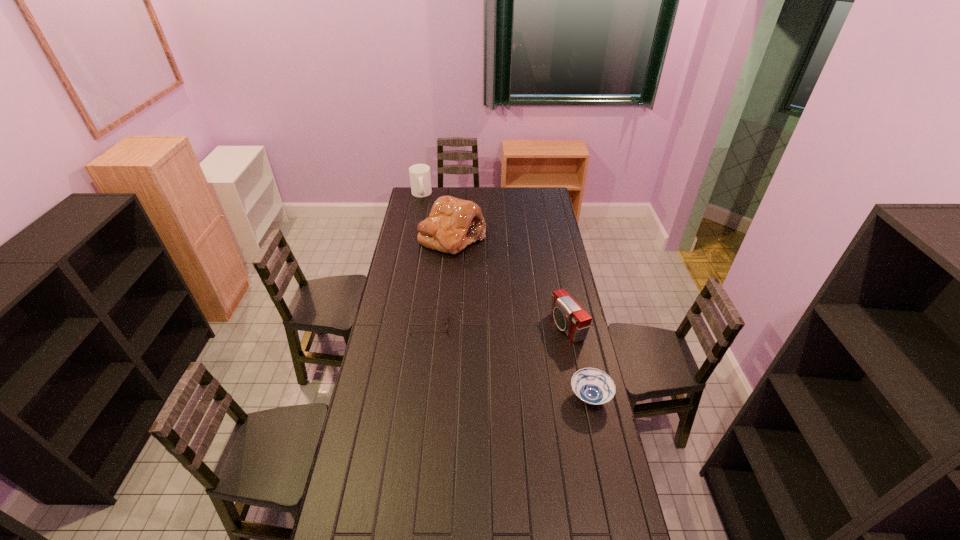
This screenshot has width=960, height=540. Identify the location of free space on the desktop that is between the shortest object and the fourth tallest object and is positioned on the filling side of the bread. (512, 362).

This screenshot has height=540, width=960. In order to click on vacant space on the desktop that is between the sunglasses and the fourth tallest object and is positioned on the handle side of the farthest object in this screenshot , I will do `click(503, 358)`.

Locate an element on the screen. free space on the desktop that is between the sunglasses and the soup bowl and is positioned on the front-facing side of the camera is located at coordinates (487, 351).